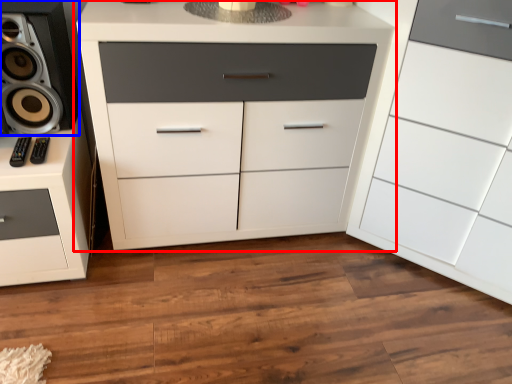
Question: Which of the following is the farthest to the observer, chest of drawers (highlighted by a red box) or speaker (highlighted by a blue box)?

Choices:
 (A) chest of drawers
 (B) speaker

Answer: (B)